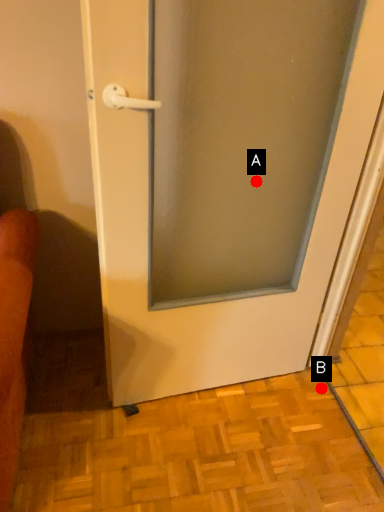
Question: Two points are circled on the image, labeled by A and B beside each circle. Among these points, which one is farthest from the camera?

Choices:
 (A) A is further
 (B) B is further

Answer: (B)